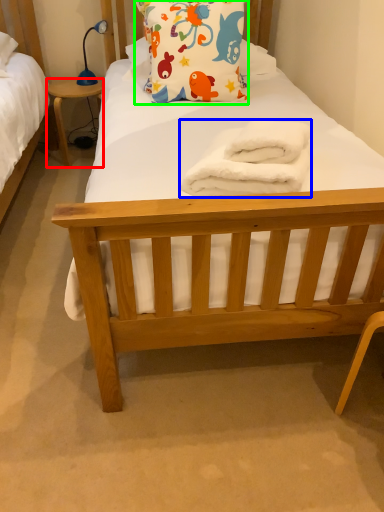
Question: Which is nearer to the desk (highlighted by a red box)? towel/napkin (highlighted by a blue box) or pillow (highlighted by a green box).

Choices:
 (A) towel/napkin
 (B) pillow

Answer: (B)